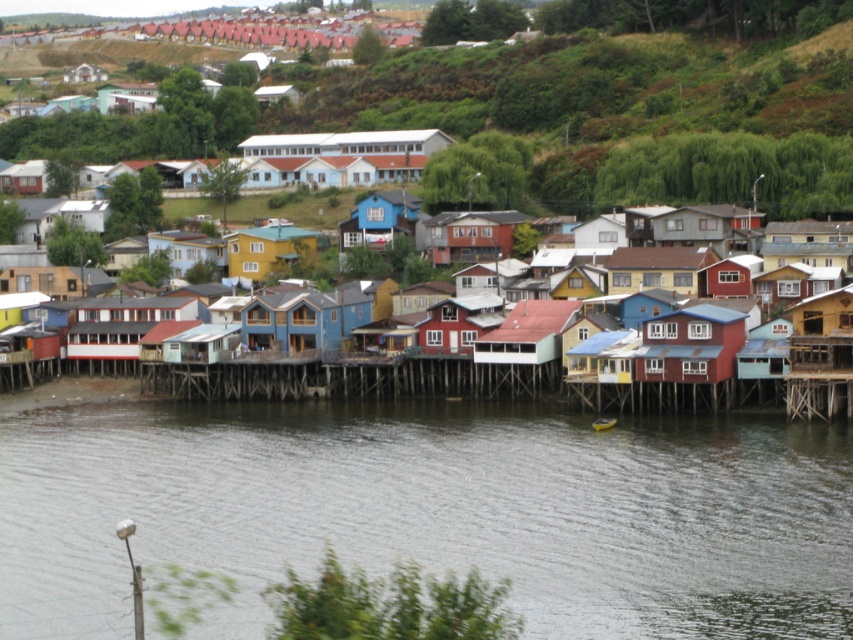
Question: Does wooden stilt houses at center have a greater width compared to red wood house at center?

Choices:
 (A) no
 (B) yes

Answer: (B)

Question: Which object is positioned farthest from the yellow matte house at center?

Choices:
 (A) gray water at lower center
 (B) red wood house at center
 (C) wooden stilt houses at center

Answer: (B)

Question: Does wooden stilt houses at center appear over yellow matte house at center?

Choices:
 (A) yes
 (B) no

Answer: (B)

Question: Which point is closer to the camera?

Choices:
 (A) gray water at lower center
 (B) yellow matte house at center
 (C) wooden stilt houses at center

Answer: (A)

Question: Is wooden stilt houses at center above yellow matte house at center?

Choices:
 (A) yes
 (B) no

Answer: (B)

Question: Which point is farther to the camera?

Choices:
 (A) (271, 252)
 (B) (496, 368)
 (C) (453, 420)

Answer: (A)